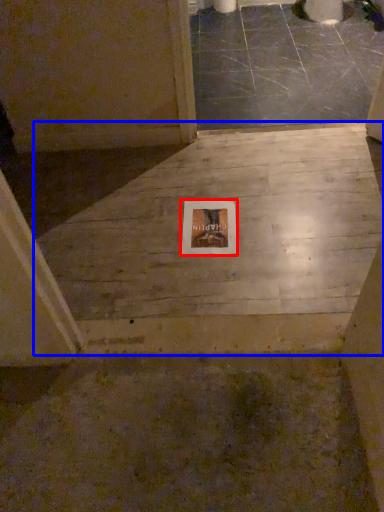
Question: Which object appears farthest to the camera in this image, picture frame (highlighted by a red box) or concrete (highlighted by a blue box)?

Choices:
 (A) picture frame
 (B) concrete

Answer: (A)